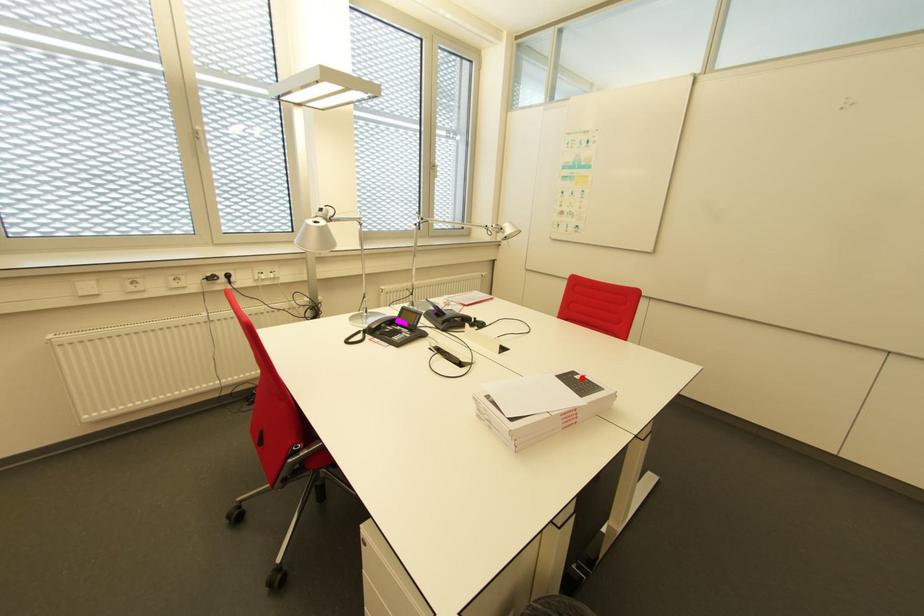
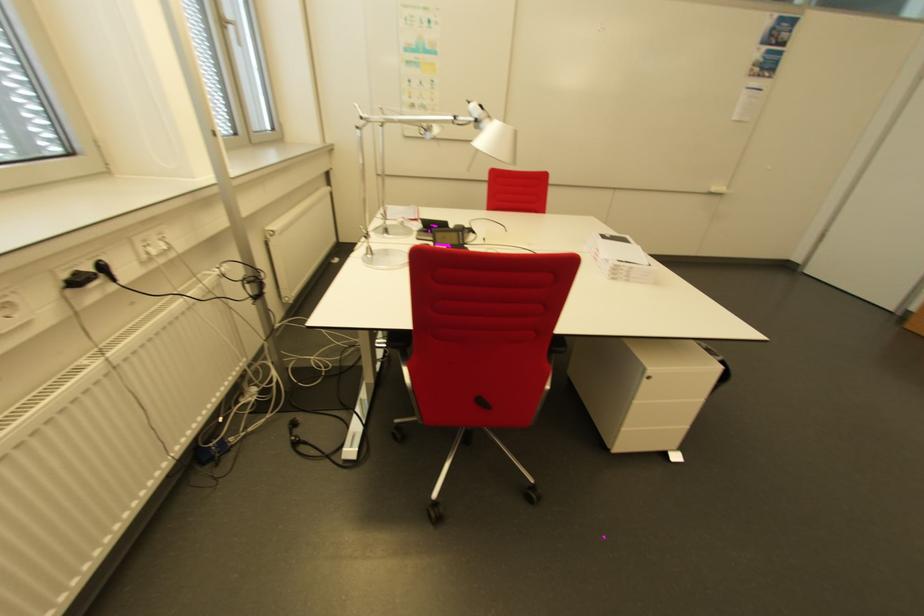
Locate, in the second image, the point that corresponds to the highlighted location in the first image.

(614, 237)